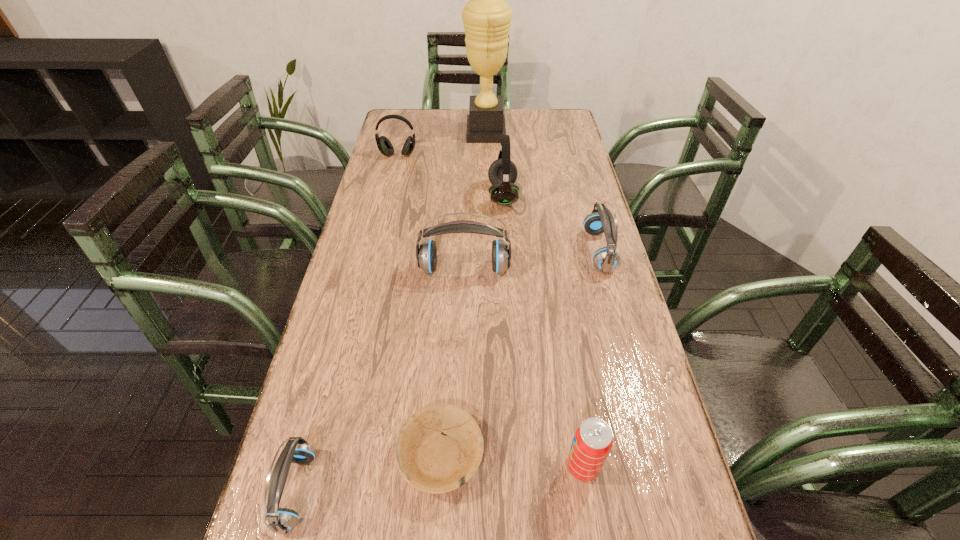
The width and height of the screenshot is (960, 540). What are the coordinates of `free spot that satisfies the following two spatial constraints: 1. on the ear cups of the shortest object; 2. on the left side of the smaller black headset` in the screenshot? It's located at (324, 456).

Locate an element on the screen. The width and height of the screenshot is (960, 540). vacant region that satisfies the following two spatial constraints: 1. on the ear cups of the nearer black headset; 2. on the back side of the second object from right to left is located at coordinates (519, 467).

The height and width of the screenshot is (540, 960). In order to click on vacant space that satisfies the following two spatial constraints: 1. on the ear cups of the rightmost blue headset; 2. on the ear cups of the second blue headset from left to right in this screenshot , I will do `click(603, 269)`.

At what (x,y) coordinates should I click in order to perform the action: click on blank area in the image that satisfies the following two spatial constraints: 1. on the ear cups of the nearer black headset; 2. on the right side of the seventh object from left to right. Please return your answer as a coordinate pair (x, y). The width and height of the screenshot is (960, 540). Looking at the image, I should click on (519, 467).